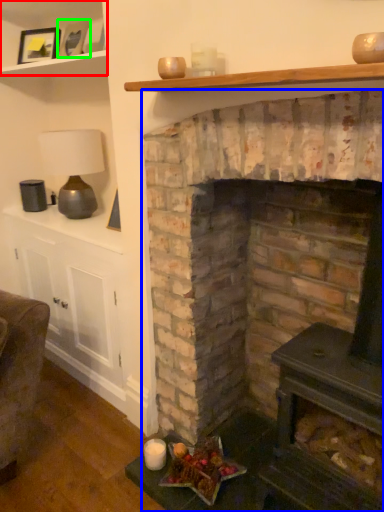
Question: Considering the real-world distances, which object is farthest from shelf (highlighted by a red box)? fireplace (highlighted by a blue box) or picture frame (highlighted by a green box)?

Choices:
 (A) fireplace
 (B) picture frame

Answer: (A)